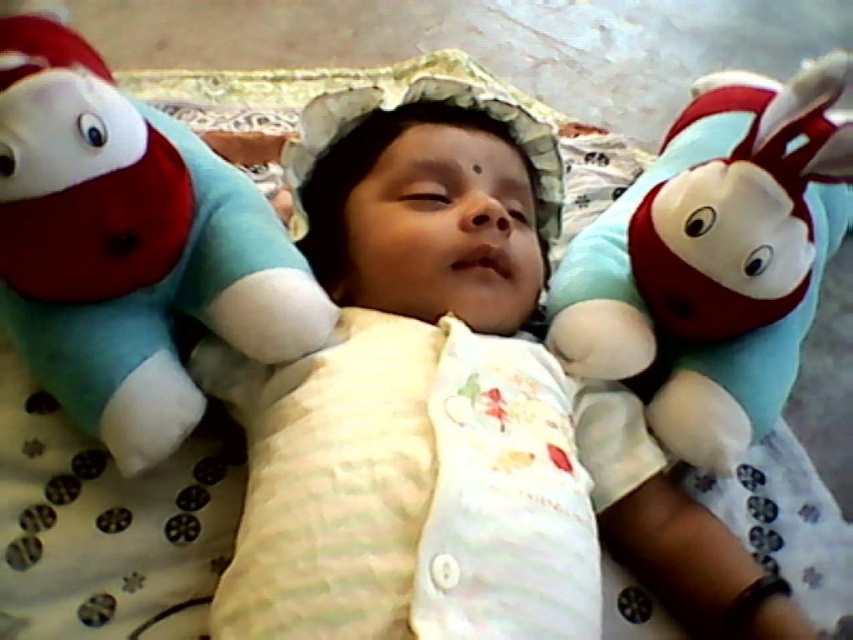
Is white soft baby at center to the right of soft plush toy at right from the viewer's perspective?

Incorrect, white soft baby at center is not on the right side of soft plush toy at right.

Between point (502, 177) and point (788, 312), which one is positioned behind?

Positioned behind is point (502, 177).

At what (x,y) coordinates should I click in order to perform the action: click on white soft baby at center. Please return your answer as a coordinate pair (x, y). This screenshot has height=640, width=853. Looking at the image, I should click on (372, 369).

Is point (316, 486) farther from camera compared to point (273, 294)?

That is False.

Which is in front, point (416, 278) or point (236, 269)?

Point (236, 269)

Measure the distance between point (341, 369) and camera.

Point (341, 369) and camera are 28.48 inches apart.

Locate an element on the screen. The image size is (853, 640). white soft baby at center is located at coordinates (372, 369).

The image size is (853, 640). I want to click on soft plush toy at left, so click(128, 244).

In the scene shown: Between soft plush toy at left and soft plush toy at right, which one has more height?

With more height is soft plush toy at right.

What do you see at coordinates (128, 244) in the screenshot? The width and height of the screenshot is (853, 640). I see `soft plush toy at left` at bounding box center [128, 244].

Where is `soft plush toy at left`? soft plush toy at left is located at coordinates (128, 244).